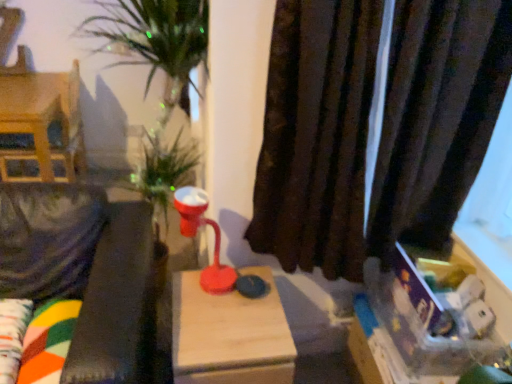
Locate an element on the screen. vacant area that lies to the right of matte plastic table lamp at center is located at coordinates (251, 294).